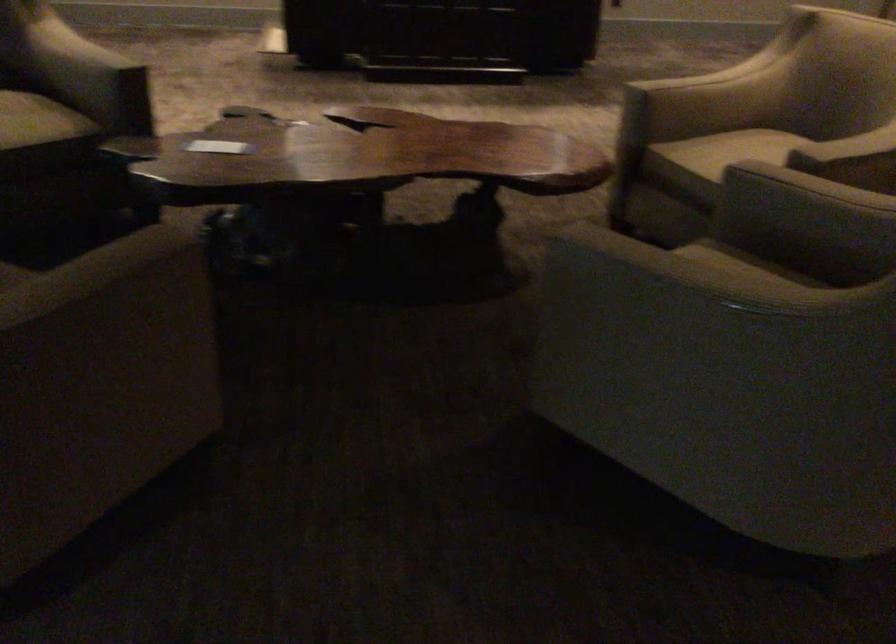
Find where to sit the chair sitting surface. Please return your answer as a coordinate pair (x, y).

(741, 149)